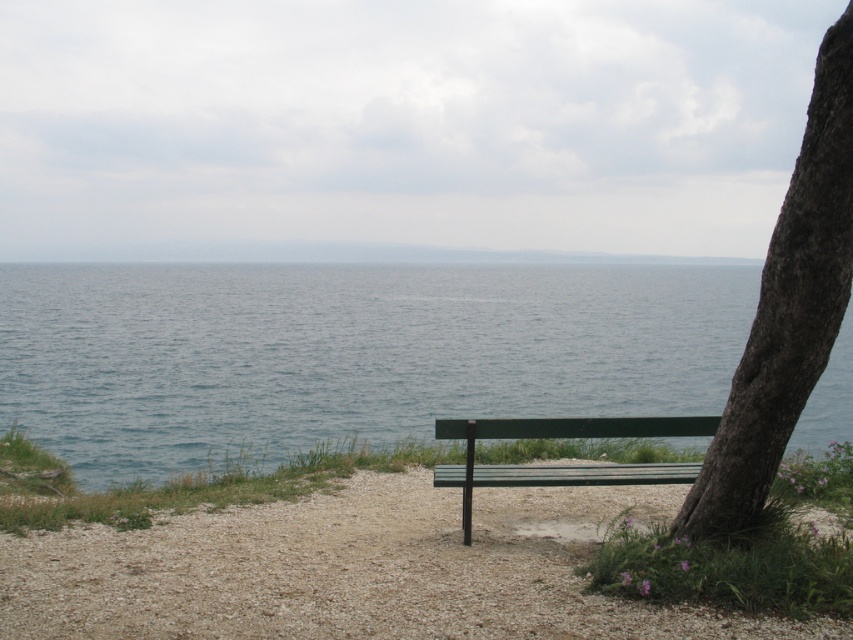
Is blue water at center wider than green wood bench at center?

Correct, the width of blue water at center exceeds that of green wood bench at center.

Does blue water at center appear on the left side of green wood bench at center?

In fact, blue water at center is to the right of green wood bench at center.

Who is more distant from viewer, (202, 436) or (285, 547)?

Point (202, 436)

This screenshot has height=640, width=853. In order to click on blue water at center in this screenshot , I will do `click(346, 353)`.

Can you confirm if blue water at center is positioned above dark brown textured bark at right?

Yes, blue water at center is above dark brown textured bark at right.

Who is more distant from viewer, (100, 371) or (833, 88)?

Positioned behind is point (100, 371).

Find the location of a particular element. Image resolution: width=853 pixels, height=640 pixels. blue water at center is located at coordinates (346, 353).

Image resolution: width=853 pixels, height=640 pixels. Describe the element at coordinates (346, 353) in the screenshot. I see `blue water at center` at that location.

Does blue water at center appear over green wooden bench at center?

Yes.

Image resolution: width=853 pixels, height=640 pixels. What do you see at coordinates (346, 353) in the screenshot?
I see `blue water at center` at bounding box center [346, 353].

The height and width of the screenshot is (640, 853). I want to click on blue water at center, so click(x=346, y=353).